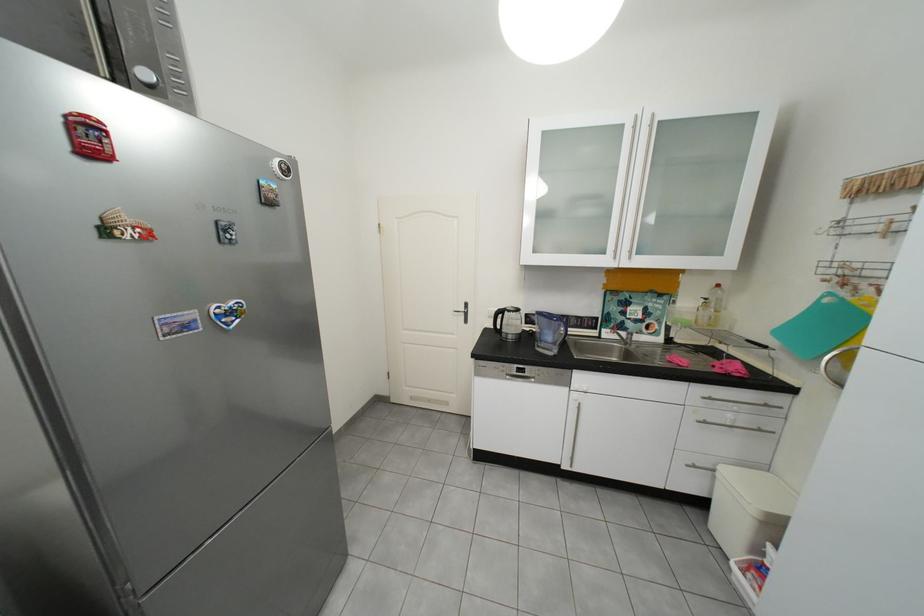
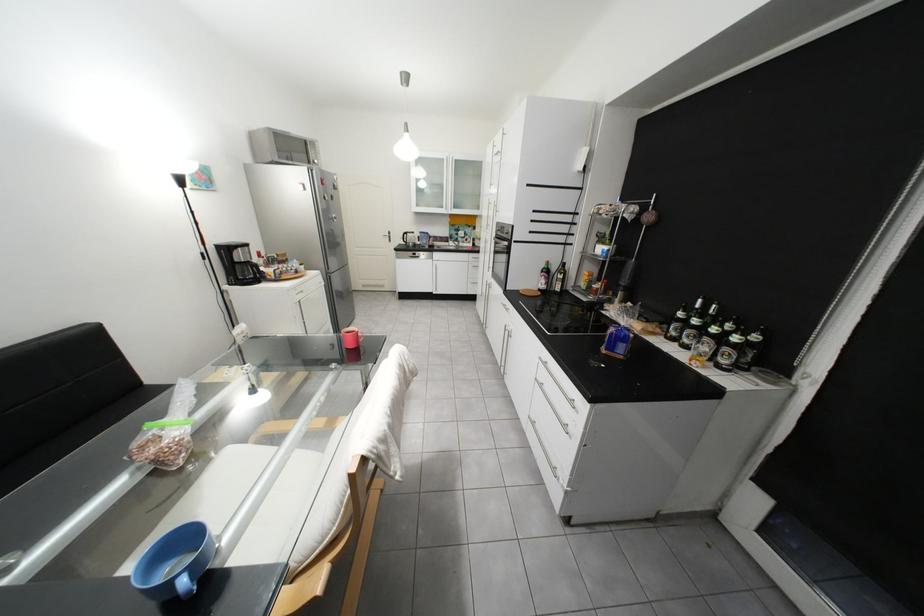
Where in the second image is the point corresponding to point (478, 306) from the first image?

(402, 233)